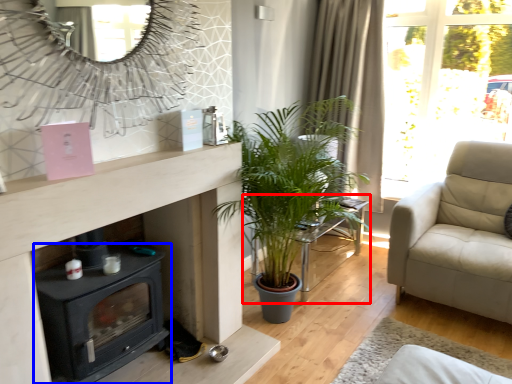
Question: Among these objects, which one is nearest to the camera, table (highlighted by a red box) or wood burning stove (highlighted by a blue box)?

Choices:
 (A) table
 (B) wood burning stove

Answer: (B)